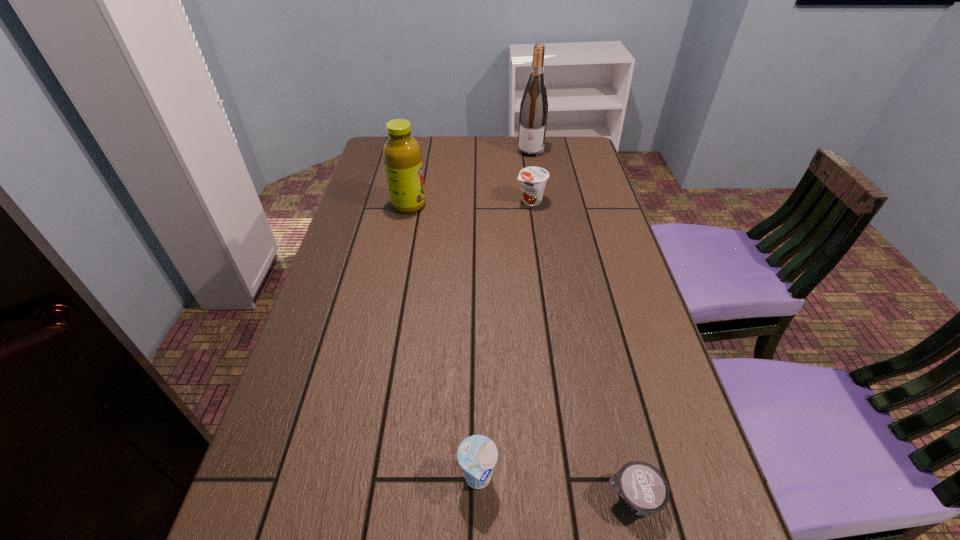
Locate an element on the screen. wine bottle is located at coordinates (534, 105).

Image resolution: width=960 pixels, height=540 pixels. Find the location of `the tallest object`. the tallest object is located at coordinates [x=534, y=105].

At what (x,y) coordinates should I click in order to perform the action: click on the leftmost object. Please return your answer as a coordinate pair (x, y). The height and width of the screenshot is (540, 960). Looking at the image, I should click on (402, 155).

At what (x,y) coordinates should I click in order to perform the action: click on the fourth shortest object. Please return your answer as a coordinate pair (x, y). This screenshot has height=540, width=960. Looking at the image, I should click on (402, 155).

Find the location of `the second yogurt from left to right`. the second yogurt from left to right is located at coordinates (533, 179).

Identify the location of the leftmost yogurt. (477, 454).

Find the location of a particular element. the rightmost yogurt is located at coordinates (642, 489).

Locate an element on the screen. Image resolution: width=960 pixels, height=540 pixels. the shortest object is located at coordinates (642, 489).

You are a GUI agent. You are given a task and a screenshot of the screen. Output one action in this format:
    pyautogui.click(x=<x>, y=<y>)
    Task: Click on the vacant space located 0.080m on the right of the farthest object
    The height and width of the screenshot is (540, 960).
    Given the screenshot: What is the action you would take?
    pyautogui.click(x=565, y=151)

At what (x,y) coordinates should I click in order to perform the action: click on vacant space located on the front label of the leftmost object. Please return your answer as a coordinate pair (x, y). Looking at the image, I should click on (475, 205).